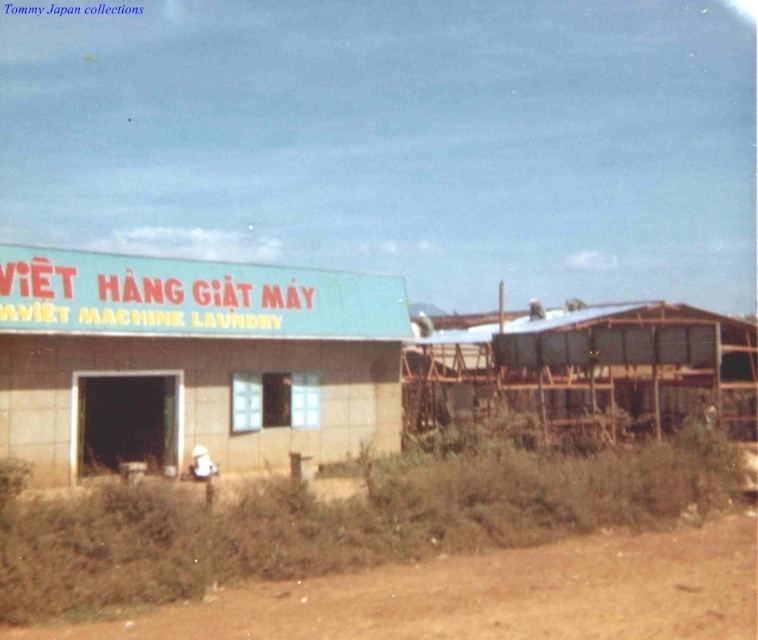
Between point (647, 536) and point (459, 332), which one is positioned behind?

Point (459, 332)

What do you see at coordinates (486, 596) in the screenshot? I see `brown dirt track at lower center` at bounding box center [486, 596].

Find the location of `brown dirt track at lower center`. brown dirt track at lower center is located at coordinates (486, 596).

Which is more to the left, beige concrete hut at center or metal/wooden hut at right?

Positioned to the left is beige concrete hut at center.

Does beige concrete hut at center appear on the right side of metal/wooden hut at right?

In fact, beige concrete hut at center is to the left of metal/wooden hut at right.

Between point (352, 420) and point (534, 337), which one is positioned behind?

Point (534, 337)

The height and width of the screenshot is (640, 758). I want to click on beige concrete hut at center, so click(x=190, y=360).

Can you confirm if beige concrete hut at center is thinner than brown dirt track at lower center?

Correct, beige concrete hut at center's width is less than brown dirt track at lower center's.

Based on the photo, can you confirm if beige concrete hut at center is positioned above brown dirt track at lower center?

Indeed, beige concrete hut at center is positioned over brown dirt track at lower center.

Find the location of a particular element. beige concrete hut at center is located at coordinates (190, 360).